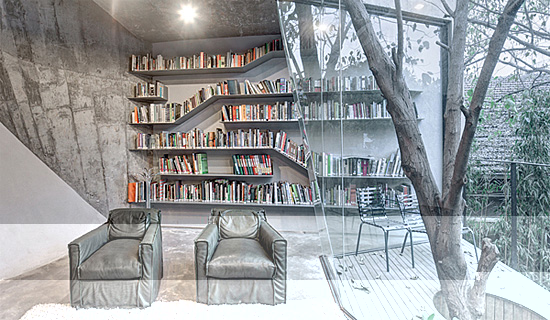
Find the location of a particular element. This screenshot has width=550, height=320. bookshelf is located at coordinates (212, 173).